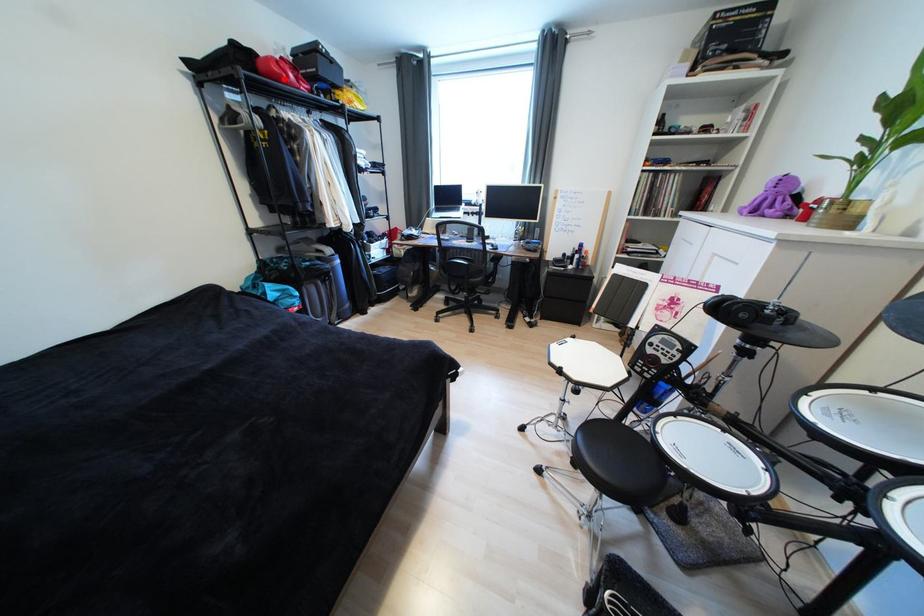
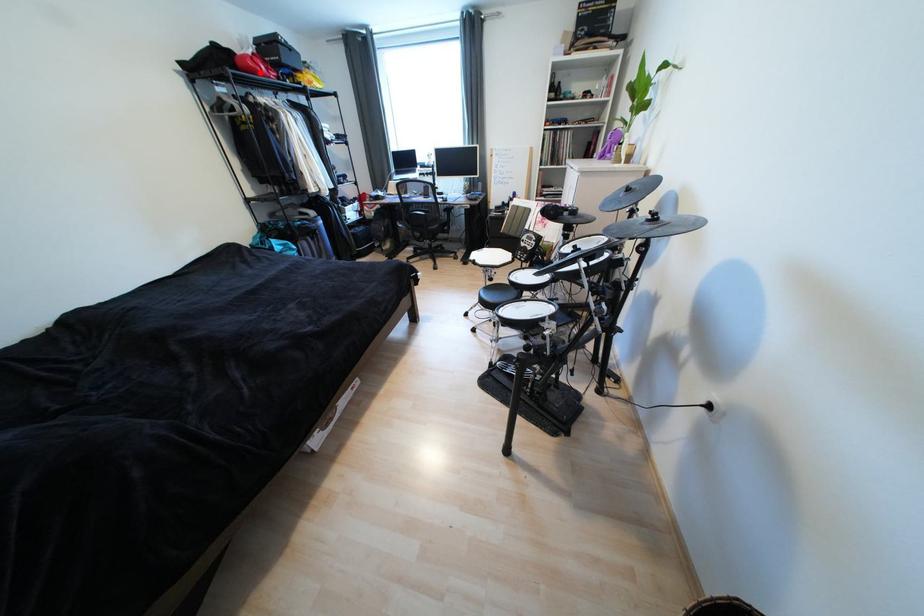
I am providing you with two images of the same scene from different viewpoints. A red point is marked on the first image and another point is marked on the second image. Is the red point in image1 aligned with the point shown in image2?

Yes